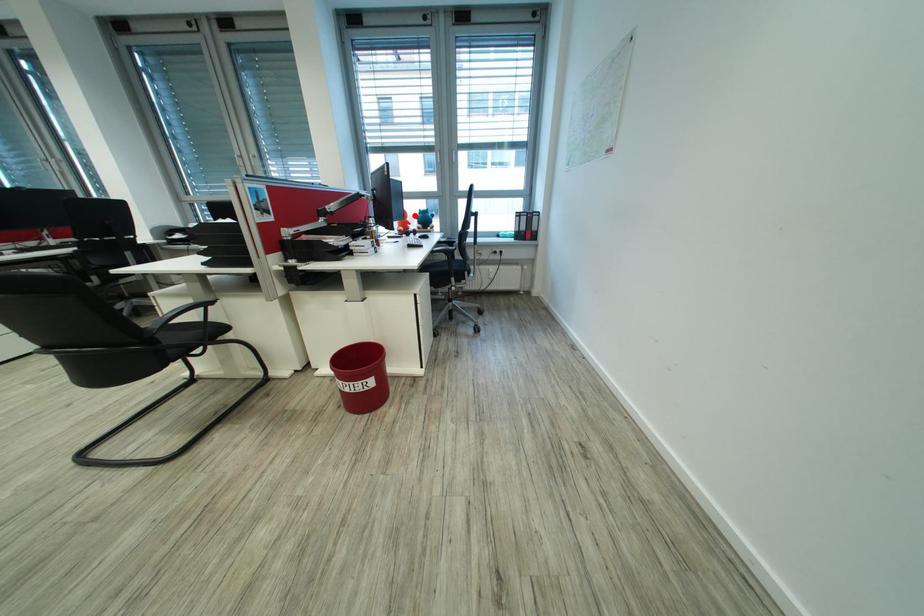
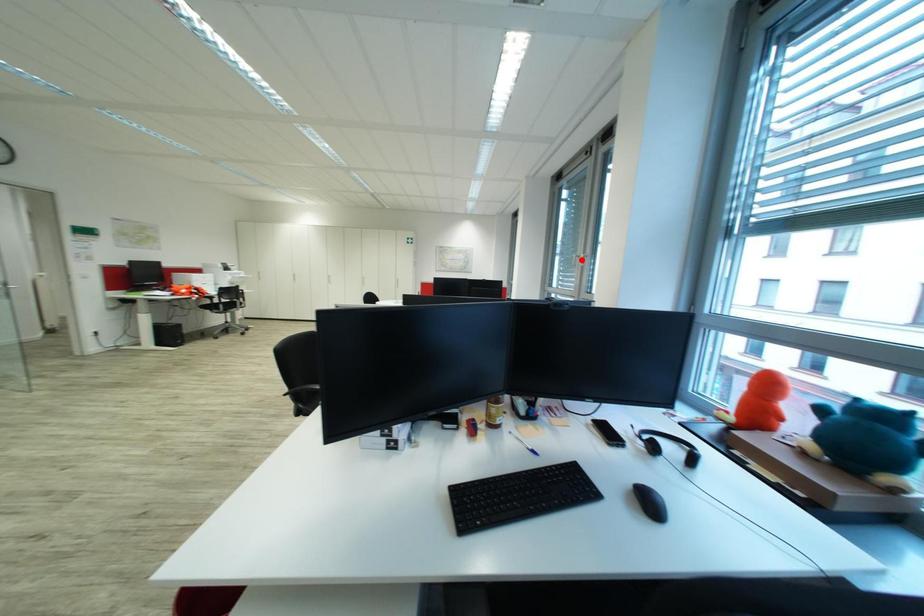
I am providing you with two images of the same scene from different viewpoints. A red point is marked on the first image and another point is marked on the second image. Does the point marked in image1 correspond to the same location as the one in image2?

No